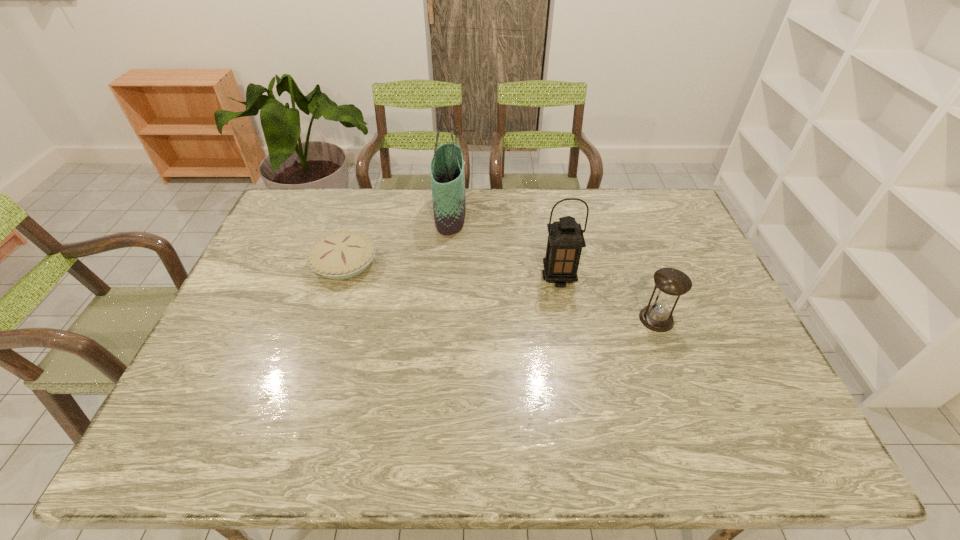
The height and width of the screenshot is (540, 960). I want to click on free space located on the front of the nearest object, so click(x=668, y=351).

Locate an element on the screen. vacant space located 0.080m on the back of the shortest object is located at coordinates (356, 227).

Find the location of a particular element. This screenshot has height=540, width=960. object that is at the far edge is located at coordinates (447, 175).

In the image, there is a desktop. Where is `vacant space at the far edge`? vacant space at the far edge is located at coordinates (594, 223).

Locate an element on the screen. The image size is (960, 540). vacant space at the near edge of the desktop is located at coordinates (511, 442).

The image size is (960, 540). I want to click on blank area at the left edge, so click(x=275, y=277).

In the image, there is a desktop. Identify the location of free region at the right edge. (696, 340).

In the image, there is a desktop. At what (x,y) coordinates should I click in order to perform the action: click on free region at the far left corner. Please return your answer as a coordinate pair (x, y). The height and width of the screenshot is (540, 960). Looking at the image, I should click on (313, 227).

In the image, there is a desktop. In order to click on blank space at the near left corner in this screenshot , I will do `click(159, 447)`.

Where is `vacant region at the far right corner of the desktop`? The width and height of the screenshot is (960, 540). vacant region at the far right corner of the desktop is located at coordinates (665, 192).